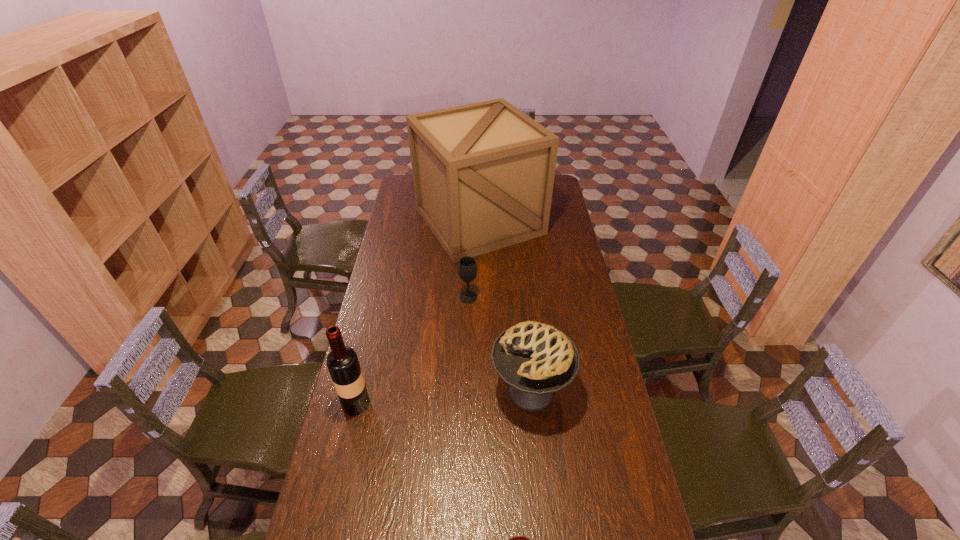
At what (x,y) coordinates should I click in order to perform the action: click on blank space located on the cut side of the pie. Please return your answer as a coordinate pair (x, y). The height and width of the screenshot is (540, 960). Looking at the image, I should click on (472, 391).

Locate an element on the screen. vacant area situated 0.100m on the cut side of the pie is located at coordinates (461, 391).

Find the location of a particular element. vacant space located on the left of the fourth nearest object is located at coordinates (433, 297).

Where is `object that is positioned at the far edge`? This screenshot has width=960, height=540. object that is positioned at the far edge is located at coordinates (483, 173).

Locate an element on the screen. The image size is (960, 540). box present at the left edge is located at coordinates (483, 173).

Where is `wine bottle at the left edge`? The width and height of the screenshot is (960, 540). wine bottle at the left edge is located at coordinates (342, 362).

Image resolution: width=960 pixels, height=540 pixels. Identify the location of box present at the right edge. (483, 173).

Where is `pie located at the right edge`? pie located at the right edge is located at coordinates (535, 360).

At what (x,y) coordinates should I click in order to perform the action: click on object that is at the far left corner. Please return your answer as a coordinate pair (x, y). The width and height of the screenshot is (960, 540). Looking at the image, I should click on coord(483,173).

I want to click on object that is at the far right corner, so click(483, 173).